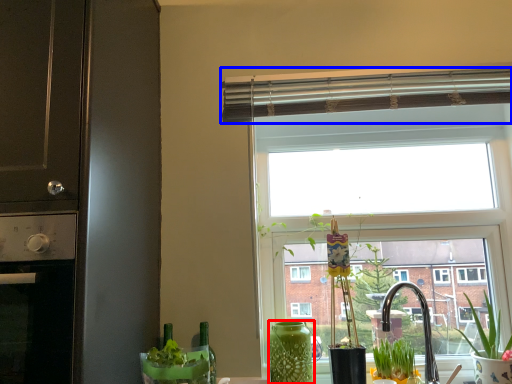
Question: Which point is closer to the camera, vase (highlighted by a red box) or window blind (highlighted by a blue box)?

Choices:
 (A) vase
 (B) window blind

Answer: (A)